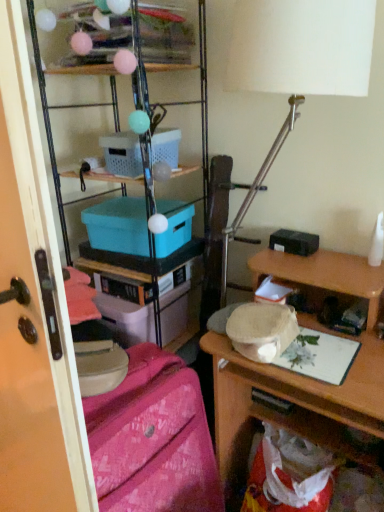
Question: Does transparent plastic screen door at left have a greater height compared to pink fabric suitcase at lower left?

Choices:
 (A) no
 (B) yes

Answer: (B)

Question: From the image's perspective, does transparent plastic screen door at left appear lower than pink fabric suitcase at lower left?

Choices:
 (A) no
 (B) yes

Answer: (A)

Question: Does transparent plastic screen door at left have a smaller size compared to pink fabric suitcase at lower left?

Choices:
 (A) no
 (B) yes

Answer: (A)

Question: Considering the relative positions of transparent plastic screen door at left and pink fabric suitcase at lower left in the image provided, is transparent plastic screen door at left to the left of pink fabric suitcase at lower left from the viewer's perspective?

Choices:
 (A) yes
 (B) no

Answer: (A)

Question: From the image's perspective, would you say transparent plastic screen door at left is positioned over pink fabric suitcase at lower left?

Choices:
 (A) no
 (B) yes

Answer: (B)

Question: Is transparent plastic screen door at left further to the viewer compared to pink fabric suitcase at lower left?

Choices:
 (A) no
 (B) yes

Answer: (A)

Question: Does white matte table lamp at upper center appear on the right side of matte plastic storage at upper left, the 1th shelf positioned from the bottom?

Choices:
 (A) yes
 (B) no

Answer: (A)

Question: Does white matte table lamp at upper center contain matte plastic storage at upper left, the 2th shelf viewed from the top?

Choices:
 (A) no
 (B) yes

Answer: (A)

Question: Is white matte table lamp at upper center next to matte plastic storage at upper left, the 2th shelf viewed from the top, and touching it?

Choices:
 (A) no
 (B) yes

Answer: (A)

Question: Does white matte table lamp at upper center appear on the left side of matte plastic storage at upper left, the 1th shelf positioned from the bottom?

Choices:
 (A) no
 (B) yes

Answer: (A)

Question: From the image's perspective, is white matte table lamp at upper center on matte plastic storage at upper left, the 2th shelf viewed from the top?

Choices:
 (A) yes
 (B) no

Answer: (A)

Question: From a real-world perspective, is white matte table lamp at upper center positioned over matte plastic storage at upper left, the 1th shelf positioned from the bottom, based on gravity?

Choices:
 (A) no
 (B) yes

Answer: (B)

Question: From the image's perspective, is white plastic box at upper center, the first box when ordered from top to bottom, on teal plastic box at center, the 1th box from the bottom?

Choices:
 (A) no
 (B) yes

Answer: (B)